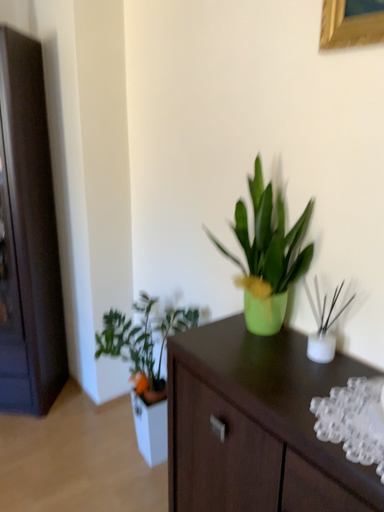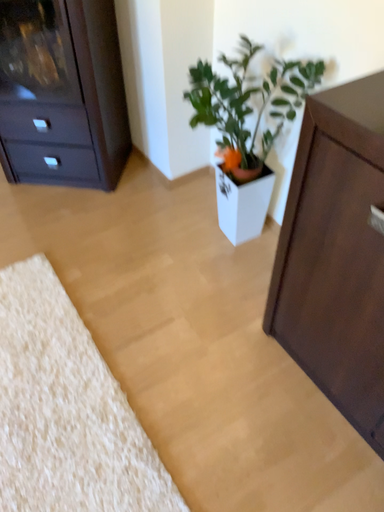
Question: How did the camera likely rotate when shooting the video?

Choices:
 (A) rotated downward
 (B) rotated upward

Answer: (A)